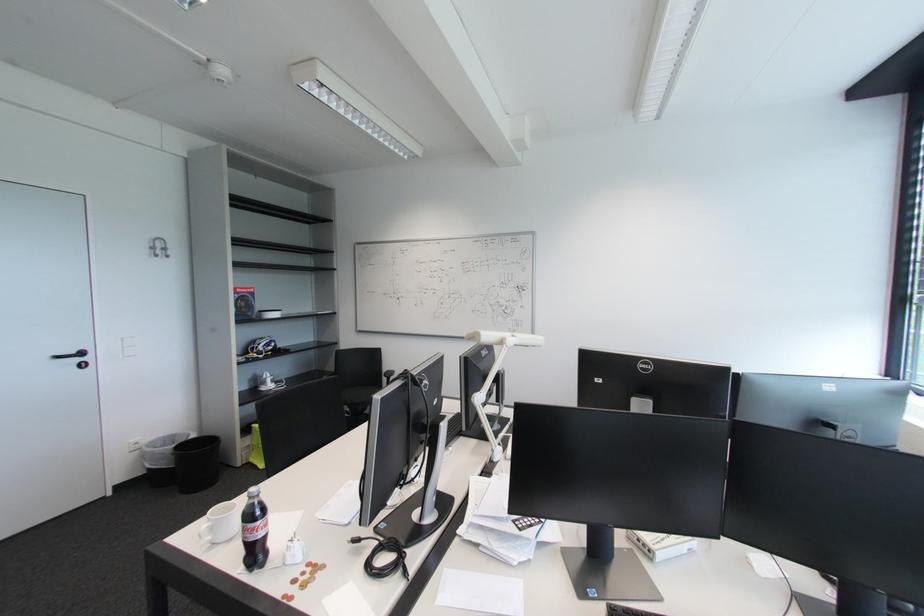
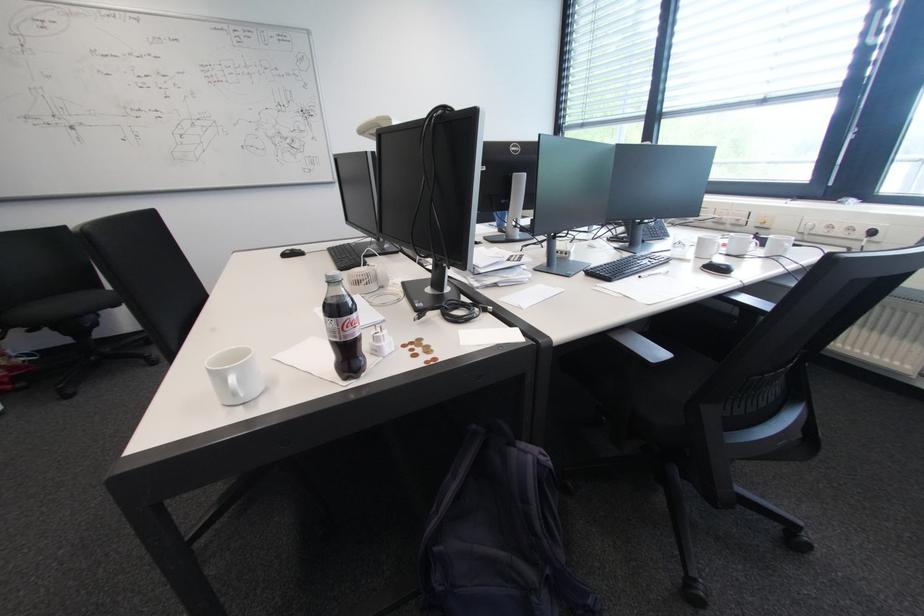
Locate, in the second image, the point that corresponds to the point at 262,521 in the first image.

(355, 313)